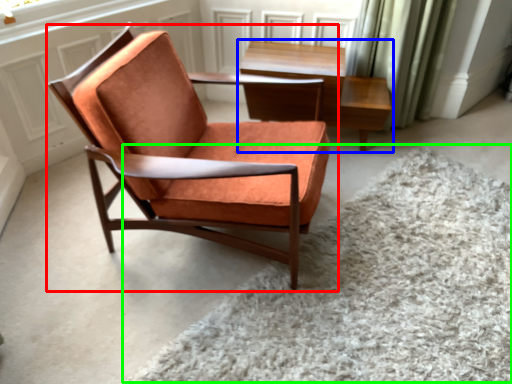
Question: Estimate the real-world distances between objects in this image. Which object is closer to chair (highlighted by a red box), table (highlighted by a blue box) or plain (highlighted by a green box)?

Choices:
 (A) table
 (B) plain

Answer: (B)